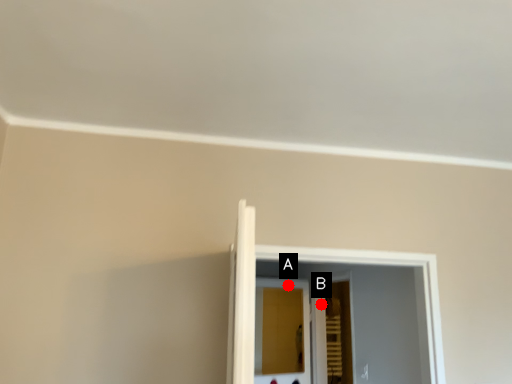
Question: Two points are circled on the image, labeled by A and B beside each circle. Which point is farther from the camera taking this photo?

Choices:
 (A) A is further
 (B) B is further

Answer: (B)